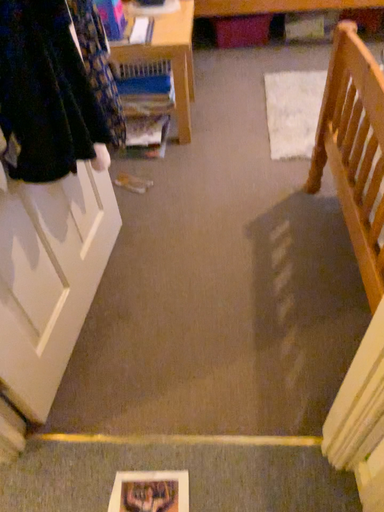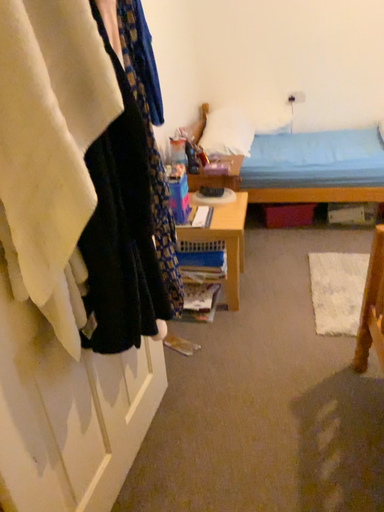
Question: How did the camera likely rotate when shooting the video?

Choices:
 (A) rotated downward
 (B) rotated upward

Answer: (B)